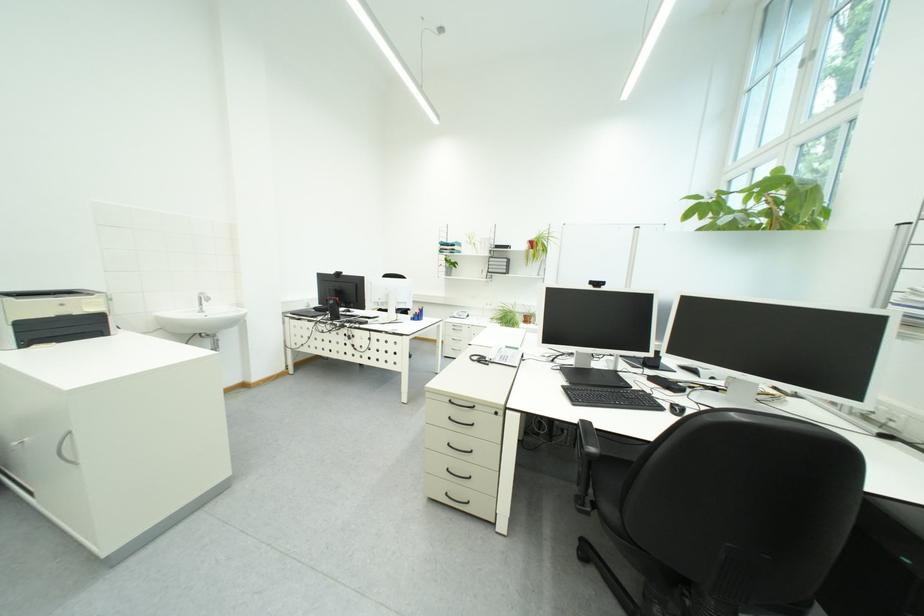
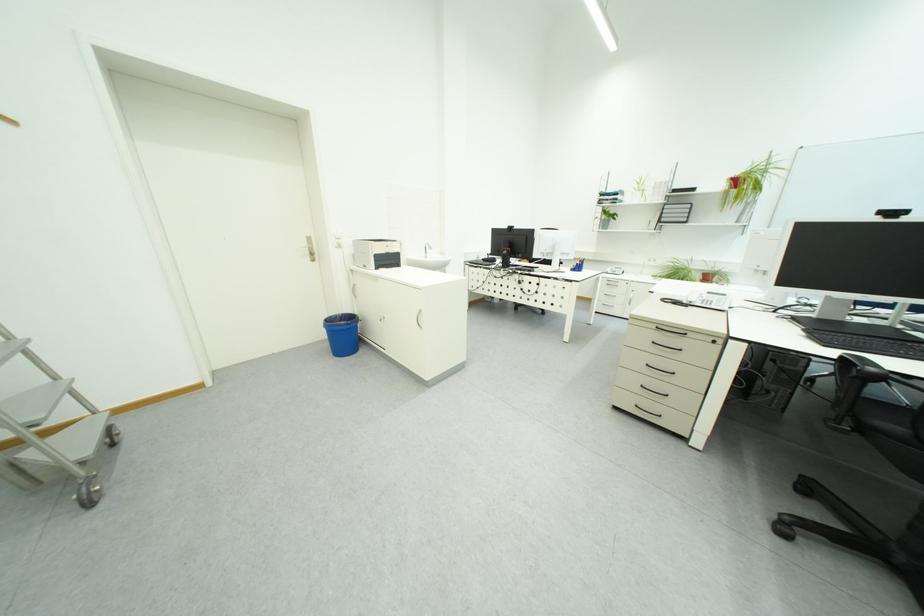
In the second image, find the point that corresponds to the point at 543,238 in the first image.

(748, 175)